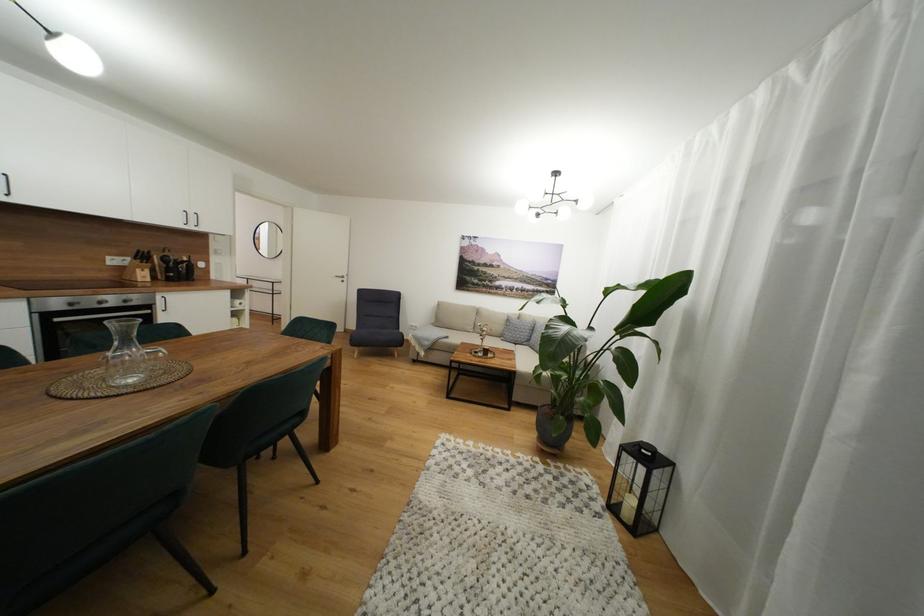
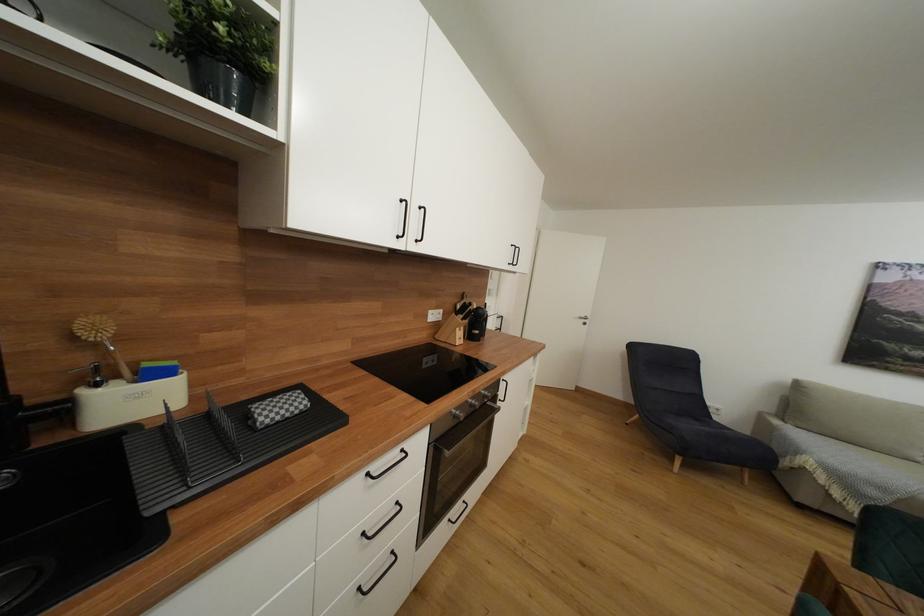
Question: What movement of the cameraman would produce the second image?

Choices:
 (A) Left
 (B) Right
 (C) Forward
 (D) Backward

Answer: (A)